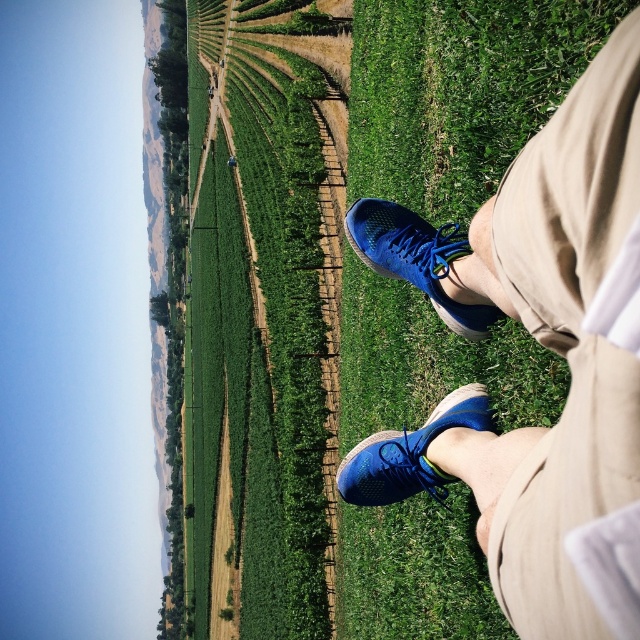
Question: Observing the image, what is the correct spatial positioning of blue mesh sneakers at lower right in reference to blue mesh shoe at lower right?

Choices:
 (A) above
 (B) below

Answer: (B)

Question: Is green grass at center smaller than blue mesh sneakers at lower right?

Choices:
 (A) yes
 (B) no

Answer: (B)

Question: Is green grass at center positioned in front of blue mesh shoe at lower center?

Choices:
 (A) no
 (B) yes

Answer: (A)

Question: Which object is the farthest from the blue mesh shoe at lower right?

Choices:
 (A) green grass at center
 (B) blue mesh sneakers at lower right
 (C) blue mesh shoe at lower center

Answer: (A)

Question: Which of the following is the farthest from the observer?

Choices:
 (A) (282, 508)
 (B) (512, 225)
 (C) (449, 227)

Answer: (A)

Question: Which point is closer to the camera?

Choices:
 (A) (442, 486)
 (B) (394, 248)
 (C) (621, 433)
 (D) (273, 317)

Answer: (C)